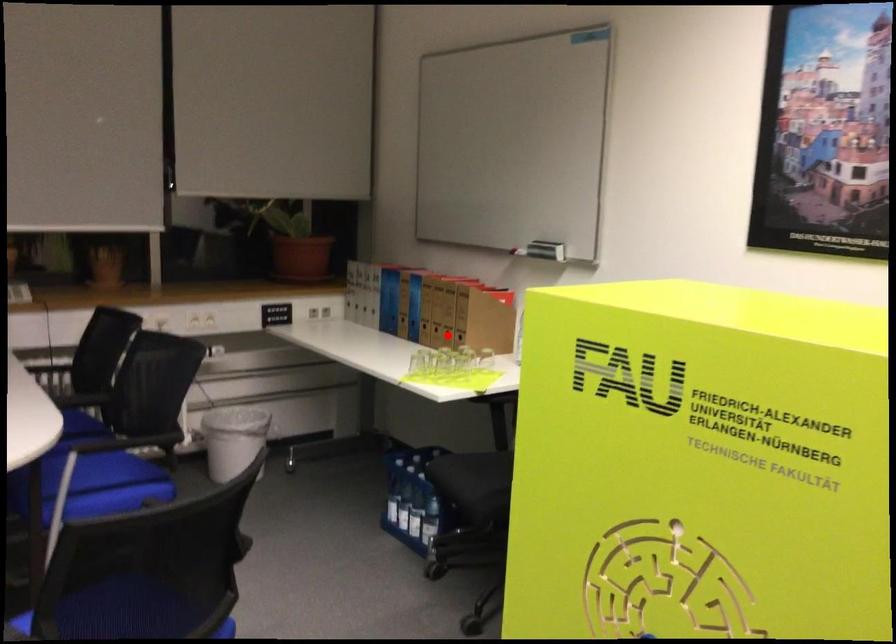
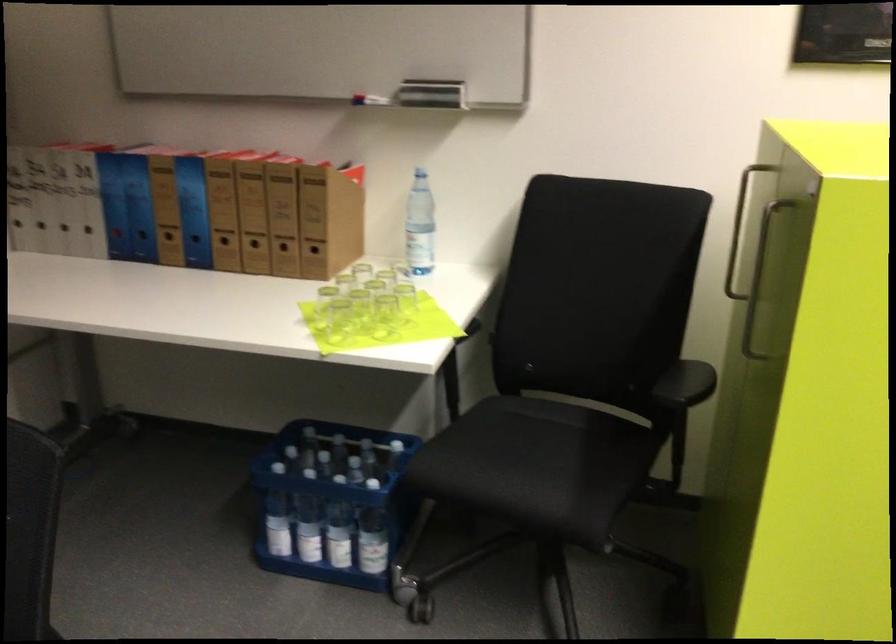
Question: I am providing you with two images of the same scene from different viewpoints. Given a red point in image1, look at the same physical point in image2. Is it:

Choices:
 (A) Closer to the viewpoint
 (B) Farther from the viewpoint

Answer: (A)